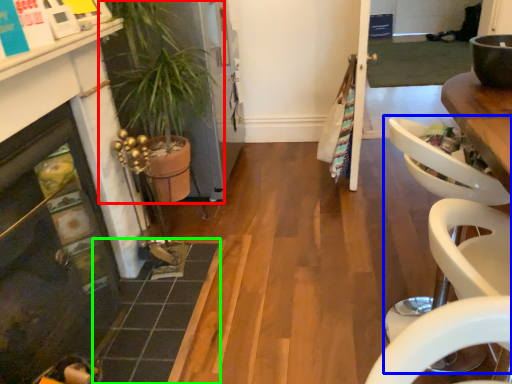
Question: Which object is positioned farthest from houseplant (highlighted by a red box)? Select from armchair (highlighted by a blue box) and tile (highlighted by a green box).

Choices:
 (A) armchair
 (B) tile

Answer: (A)